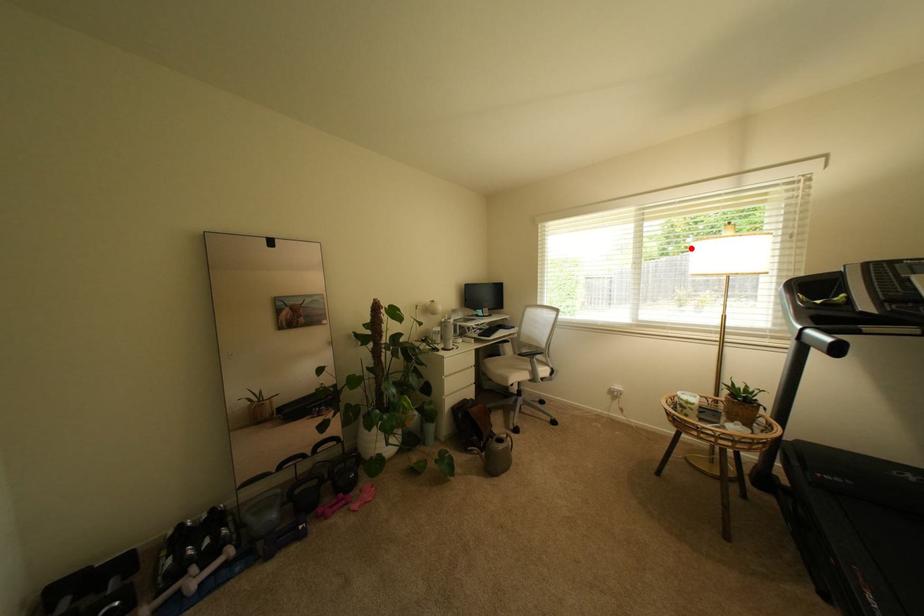
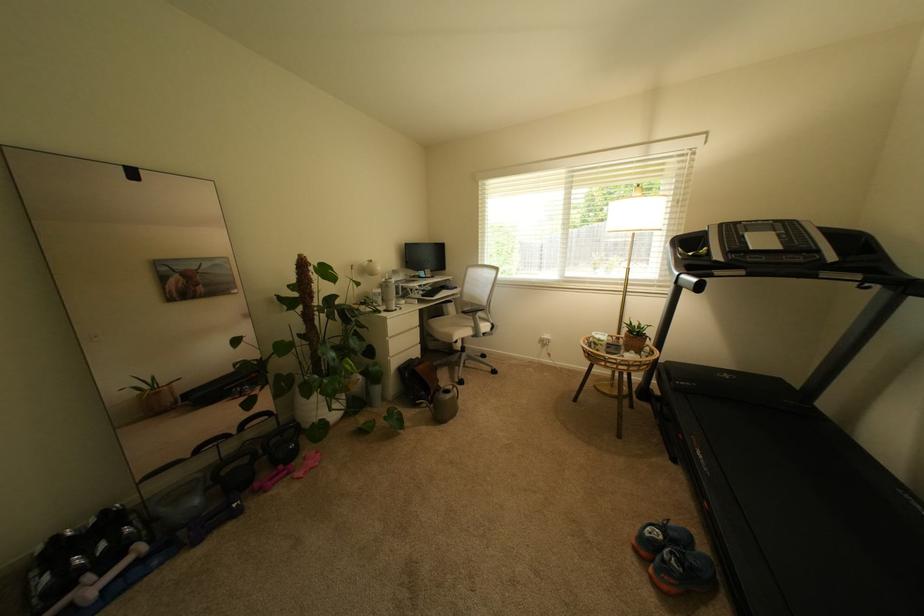
Where in the second image is the point corresponding to the highlighted location from the first image?

(608, 217)